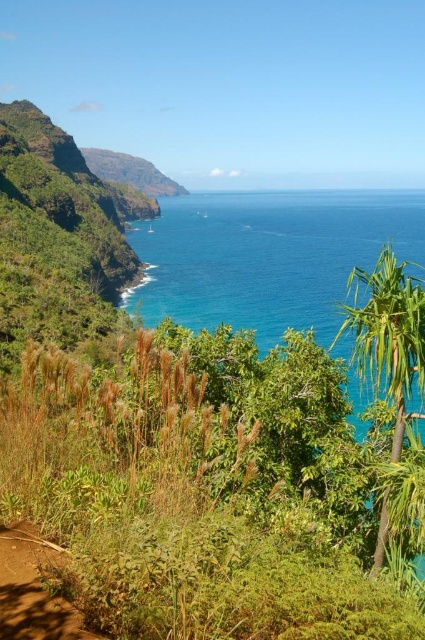
Question: Is green grassy shrubs at lower left wider than blue glossy water at center?

Choices:
 (A) yes
 (B) no

Answer: (B)

Question: Which object appears closest to the camera in this image?

Choices:
 (A) blue glossy water at center
 (B) green grassy shrubs at lower left

Answer: (B)

Question: Which point appears closest to the camera in this image?

Choices:
 (A) (405, 244)
 (B) (306, 572)

Answer: (B)

Question: Is green grassy shrubs at lower left thinner than blue glossy water at center?

Choices:
 (A) yes
 (B) no

Answer: (A)

Question: Can you confirm if green grassy shrubs at lower left is bigger than blue glossy water at center?

Choices:
 (A) no
 (B) yes

Answer: (A)